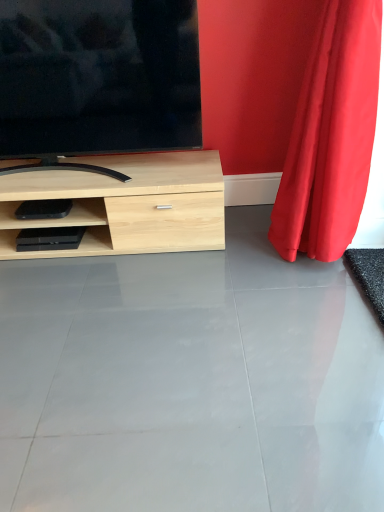
This screenshot has height=512, width=384. Identify the location of matte black tv at upper left. (x=98, y=78).

Image resolution: width=384 pixels, height=512 pixels. What do you see at coordinates (331, 135) in the screenshot?
I see `red velvet curtain at right` at bounding box center [331, 135].

This screenshot has height=512, width=384. What are the coordinates of `gray glossy concrete at center` in the screenshot? It's located at (190, 382).

Between gray glossy concrete at center and matte black tv at upper left, which one has more height?

With more height is matte black tv at upper left.

From the image's perspective, would you say gray glossy concrete at center is positioned over matte black tv at upper left?

No.

Is gray glossy concrete at center not inside matte black tv at upper left?

Absolutely, gray glossy concrete at center is external to matte black tv at upper left.

Would you consider matte black tv at upper left to be distant from red velvet curtain at right?

No, matte black tv at upper left is in close proximity to red velvet curtain at right.

This screenshot has height=512, width=384. I want to click on television above the red velvet curtain at right (from the image's perspective), so click(98, 78).

Is matte black tv at upper left oriented towards red velvet curtain at right?

No, matte black tv at upper left is not facing towards red velvet curtain at right.

Is matte black tv at upper left to the left or to the right of red velvet curtain at right in the image?

From the image, it's evident that matte black tv at upper left is to the left of red velvet curtain at right.

How different are the orientations of red velvet curtain at right and gray glossy concrete at center in degrees?

They differ by 2.08 degrees in their facing directions.

Between red velvet curtain at right and gray glossy concrete at center, which one has larger size?

red velvet curtain at right is bigger.

You are a GUI agent. You are given a task and a screenshot of the screen. Output one action in this format:
    pyautogui.click(x=<x>, y=<y>)
    Task: Click on the concrete below the red velvet curtain at right (from the image's perspective)
    The height and width of the screenshot is (512, 384).
    Given the screenshot: What is the action you would take?
    pyautogui.click(x=190, y=382)

Is red velvet curtain at right outside of gray glossy concrete at center?

Yes, red velvet curtain at right is located beyond the bounds of gray glossy concrete at center.

Can you tell me how much matte black tv at upper left and gray glossy concrete at center differ in facing direction?

matte black tv at upper left and gray glossy concrete at center are facing 91.2 degrees away from each other.

From the image's perspective, is matte black tv at upper left above gray glossy concrete at center?

Yes.

Measure the distance from matte black tv at upper left to gray glossy concrete at center.

A distance of 37.09 inches exists between matte black tv at upper left and gray glossy concrete at center.

Where is `television above the gray glossy concrete at center (from a real-world perspective)`? Image resolution: width=384 pixels, height=512 pixels. television above the gray glossy concrete at center (from a real-world perspective) is located at coordinates (98, 78).

Who is bigger, gray glossy concrete at center or red velvet curtain at right?

red velvet curtain at right is bigger.

The image size is (384, 512). In order to click on curtain that is on the right side of gray glossy concrete at center in this screenshot , I will do `click(331, 135)`.

From the picture: How much distance is there between gray glossy concrete at center and red velvet curtain at right?

gray glossy concrete at center and red velvet curtain at right are 23.82 inches apart.

Does gray glossy concrete at center touch red velvet curtain at right?

No, gray glossy concrete at center is not with red velvet curtain at right.

Is red velvet curtain at right at the left side of matte black tv at upper left?

In fact, red velvet curtain at right is to the right of matte black tv at upper left.

In the scene shown: Measure the distance from red velvet curtain at right to matte black tv at upper left.

red velvet curtain at right is 28.52 inches from matte black tv at upper left.

Is red velvet curtain at right looking in the opposite direction of matte black tv at upper left?

No, red velvet curtain at right is not facing away from matte black tv at upper left.

Who is taller, red velvet curtain at right or matte black tv at upper left?

red velvet curtain at right is taller.

Identify the location of concrete below the matte black tv at upper left (from the image's perspective). (190, 382).

I want to click on television above the red velvet curtain at right (from the image's perspective), so click(98, 78).

In the scene shown: Considering their positions, is red velvet curtain at right positioned further to gray glossy concrete at center than matte black tv at upper left?

matte black tv at upper left is further to gray glossy concrete at center.

From the image, which object appears to be nearer to matte black tv at upper left, red velvet curtain at right or gray glossy concrete at center?

The object closer to matte black tv at upper left is red velvet curtain at right.

Which object lies further to the anchor point red velvet curtain at right, gray glossy concrete at center or matte black tv at upper left?

matte black tv at upper left is further to red velvet curtain at right.

Looking at the image, which one is located closer to matte black tv at upper left, gray glossy concrete at center or red velvet curtain at right?

Among the two, red velvet curtain at right is located nearer to matte black tv at upper left.

Looking at the image, which one is located further to gray glossy concrete at center, matte black tv at upper left or red velvet curtain at right?

Based on the image, matte black tv at upper left appears to be further to gray glossy concrete at center.

Based on their spatial positions, is matte black tv at upper left or gray glossy concrete at center closer to red velvet curtain at right?

Among the two, gray glossy concrete at center is located nearer to red velvet curtain at right.

This screenshot has width=384, height=512. Find the location of `concrete between matte black tv at upper left and red velvet curtain at right from left to right`. concrete between matte black tv at upper left and red velvet curtain at right from left to right is located at coordinates (190, 382).